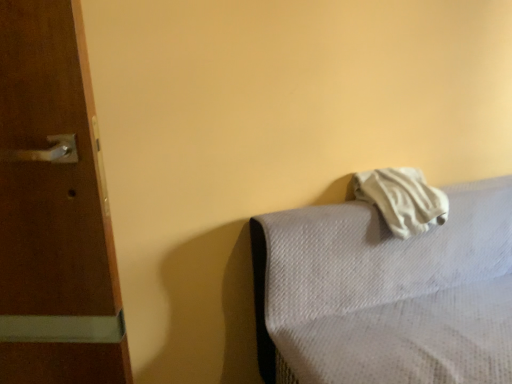
What do you see at coordinates (387, 293) in the screenshot? The width and height of the screenshot is (512, 384). I see `white textured mattress at right` at bounding box center [387, 293].

Where is `white textured mattress at right`? The image size is (512, 384). white textured mattress at right is located at coordinates (387, 293).

Locate an element on the screen. Image resolution: width=512 pixels, height=384 pixels. white soft towel at upper right is located at coordinates (401, 199).

What is the approximate width of white soft towel at upper right?

8.80 inches.

Measure the distance between point (416, 183) and camera.

Point (416, 183) is 1.39 meters away from camera.

The width and height of the screenshot is (512, 384). What do you see at coordinates (401, 199) in the screenshot?
I see `white soft towel at upper right` at bounding box center [401, 199].

What are the coordinates of `white textured mattress at right` in the screenshot? It's located at (387, 293).

Can you confirm if white soft towel at upper right is positioned to the right of white textured mattress at right?

In fact, white soft towel at upper right is to the left of white textured mattress at right.

Is white soft towel at upper right in front of or behind white textured mattress at right in the image?

white soft towel at upper right is behind white textured mattress at right.

Does point (404, 219) appear closer or farther from the camera than point (377, 296)?

Point (404, 219) is positioned closer to the camera compared to point (377, 296).

From the image's perspective, which one is positioned higher, white soft towel at upper right or white textured mattress at right?

white soft towel at upper right, from the image's perspective.

From a real-world perspective, is white soft towel at upper right under white textured mattress at right?

No, from a real-world perspective, white soft towel at upper right is not below white textured mattress at right.

Which object is wider, white soft towel at upper right or white textured mattress at right?

With larger width is white textured mattress at right.

Between white soft towel at upper right and white textured mattress at right, which one has less height?

white soft towel at upper right.

Does white soft towel at upper right have a larger size compared to white textured mattress at right?

Actually, white soft towel at upper right might be smaller than white textured mattress at right.

Is white soft towel at upper right not within white textured mattress at right?

No, white soft towel at upper right is inside white textured mattress at right's boundary.

Is white soft towel at upper right not near white textured mattress at right?

No, white soft towel at upper right is not far away from white textured mattress at right.

Is white soft towel at upper right facing towards white textured mattress at right?

Yes, white soft towel at upper right is aimed at white textured mattress at right.

Can you tell me how much white soft towel at upper right and white textured mattress at right differ in facing direction?

There is a 0.776-degree angle between the facing directions of white soft towel at upper right and white textured mattress at right.

Locate an element on the screen. furniture beneath the white soft towel at upper right (from a real-world perspective) is located at coordinates (387, 293).

Does white textured mattress at right appear on the left side of white soft towel at upper right?

Incorrect, white textured mattress at right is not on the left side of white soft towel at upper right.

Is the position of white textured mattress at right more distant than that of white soft towel at upper right?

No, the depth of white textured mattress at right is less than that of white soft towel at upper right.

Considering the positions of points (438, 243) and (372, 179), is point (438, 243) closer to camera compared to point (372, 179)?

No, it is not.

From the image's perspective, who appears lower, white textured mattress at right or white soft towel at upper right?

From the image's view, white textured mattress at right is below.

From a real-world perspective, which is physically above, white textured mattress at right or white soft towel at upper right?

white soft towel at upper right, from a real-world perspective.

Can you confirm if white textured mattress at right is wider than white soft towel at upper right?

Yes, white textured mattress at right is wider than white soft towel at upper right.

Is white textured mattress at right taller than white soft towel at upper right?

Yes.

Who is smaller, white textured mattress at right or white soft towel at upper right?

white soft towel at upper right is smaller.

Based on the photo, is white textured mattress at right not within white soft towel at upper right?

white textured mattress at right lies outside white soft towel at upper right's area.

Is white textured mattress at right positioned far away from white soft towel at upper right?

No, there isn't a large distance between white textured mattress at right and white soft towel at upper right.

Is white soft towel at upper right at the back of white textured mattress at right?

Yes.

Can you tell me how much white textured mattress at right and white soft towel at upper right differ in facing direction?

white textured mattress at right and white soft towel at upper right are facing 0.776 degrees away from each other.

Looking at this image, how far apart are white textured mattress at right and white soft towel at upper right?

A distance of 8.52 inches exists between white textured mattress at right and white soft towel at upper right.

The height and width of the screenshot is (384, 512). I want to click on furniture that is in front of the white soft towel at upper right, so click(x=387, y=293).

Where is `furniture located underneath the white soft towel at upper right (from a real-world perspective)`? Image resolution: width=512 pixels, height=384 pixels. furniture located underneath the white soft towel at upper right (from a real-world perspective) is located at coordinates (387, 293).

Identify the location of furniture that appears below the white soft towel at upper right (from the image's perspective). The width and height of the screenshot is (512, 384). (387, 293).